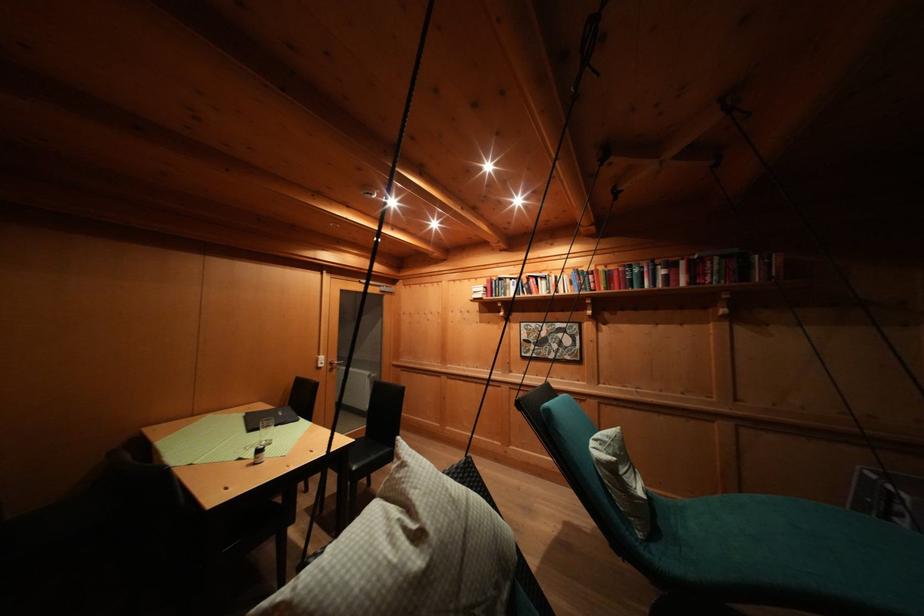
Where is `white light switch`? This screenshot has height=616, width=924. white light switch is located at coordinates (320, 361).